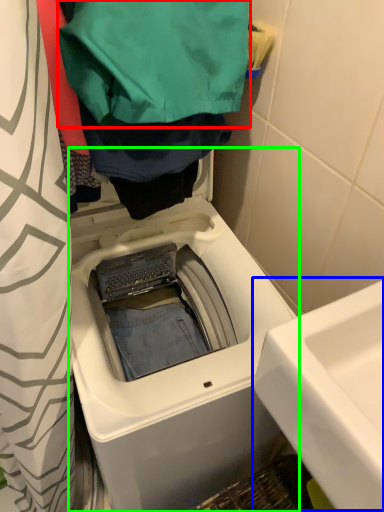
Question: Based on their relative distances, which object is farther from clothing (highlighted by a red box)? Choose from sink (highlighted by a blue box) and washing machine (highlighted by a green box).

Choices:
 (A) sink
 (B) washing machine

Answer: (A)